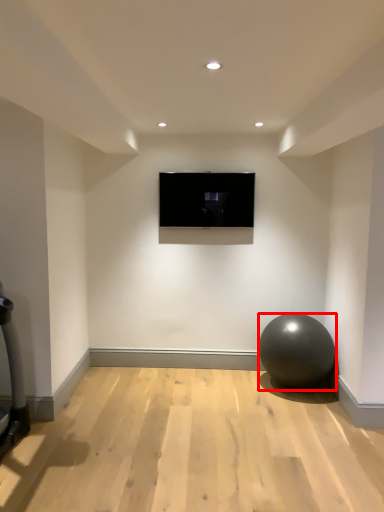
Question: From the image's perspective, what is the correct spatial positioning of ball (annotated by the red box) in reference to television?

Choices:
 (A) below
 (B) above

Answer: (A)